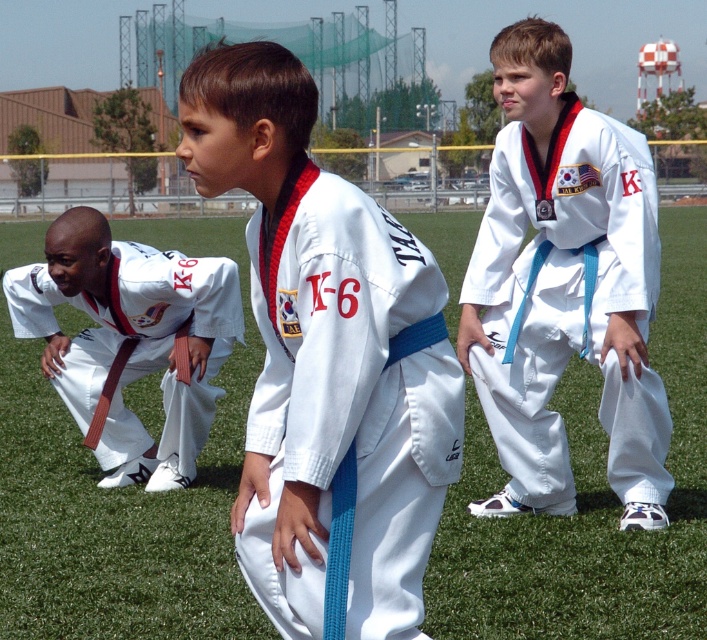
Which is above, green grass at center or brown belt karate uniform at lower left?

green grass at center is higher up.

Who is more distant from viewer, (677, 548) or (52, 269)?

Point (52, 269)

Which is behind, point (503, 477) or point (25, 292)?

Point (503, 477)

Locate an element on the screen. The width and height of the screenshot is (707, 640). green grass at center is located at coordinates (122, 499).

Where is `green grass at center`? This screenshot has height=640, width=707. green grass at center is located at coordinates (122, 499).

Is point (626, 364) closer to camera compared to point (116, 300)?

Yes, point (626, 364) is closer to viewer.

Which is behind, point (549, 259) or point (206, 378)?

The point (206, 378) is more distant.

Locate an element on the screen. This screenshot has height=640, width=707. blue fabric pants at center is located at coordinates (563, 285).